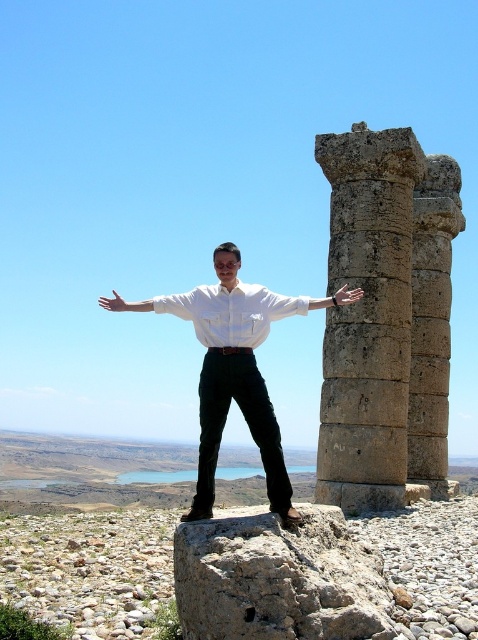
Question: Does white matte shirt at center come behind gray stone column at right?

Choices:
 (A) yes
 (B) no

Answer: (B)

Question: Considering the real-world distances, which object is closest to the white matte dress shirt at center?

Choices:
 (A) gray stone column at center
 (B) gray stone column at right
 (C) metallic silver hand at right

Answer: (C)

Question: Considering the relative positions of white matte shirt at center and metallic silver hand at right in the image provided, where is white matte shirt at center located with respect to metallic silver hand at right?

Choices:
 (A) above
 (B) below

Answer: (A)

Question: Which point is closer to the camera taking this photo?

Choices:
 (A) (218, 296)
 (B) (195, 312)
 (C) (357, 298)
 (D) (136, 307)

Answer: (A)

Question: Which of these objects is positioned farthest from the gray stone column at right?

Choices:
 (A) gray stone column at center
 (B) white matte dress shirt at center

Answer: (B)

Question: Is white matte dress shirt at center wider than metallic silver hand at right?

Choices:
 (A) yes
 (B) no

Answer: (A)